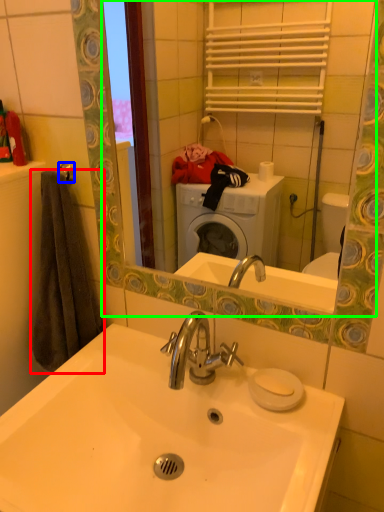
Question: Considering the real-world distances, which object is closest to bath towel (highlighted by a red box)? towel bar (highlighted by a blue box) or mirror (highlighted by a green box).

Choices:
 (A) towel bar
 (B) mirror

Answer: (A)